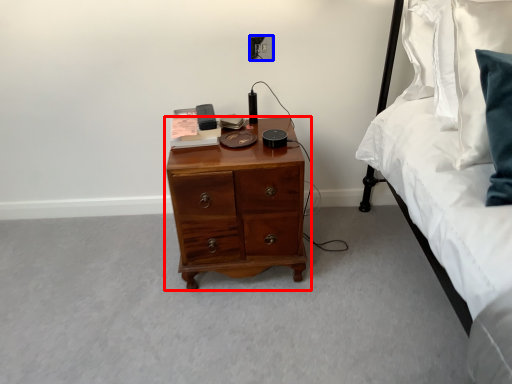
Question: Which point is further to the camera, chest of drawers (highlighted by a red box) or electric outlet (highlighted by a blue box)?

Choices:
 (A) chest of drawers
 (B) electric outlet

Answer: (B)